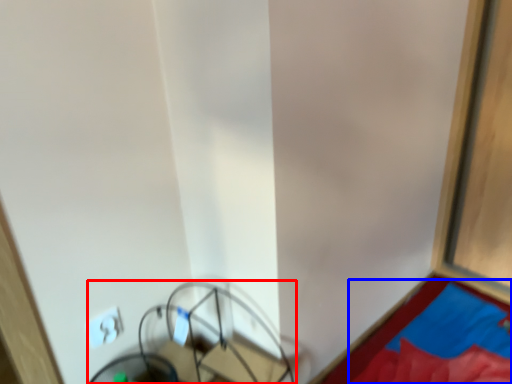
Question: Which of the following is the farthest to the observer, furniture (highlighted by a red box) or sheet (highlighted by a blue box)?

Choices:
 (A) furniture
 (B) sheet

Answer: (B)